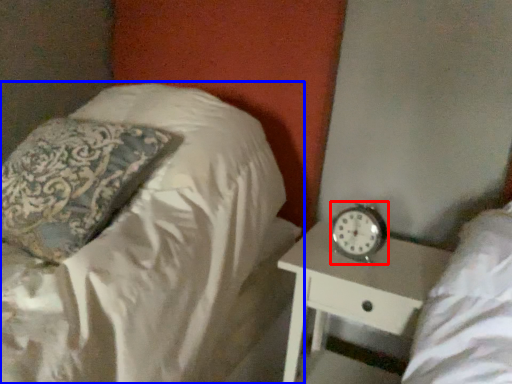
Question: Which object is further to the camera taking this photo, clock (highlighted by a red box) or bed (highlighted by a blue box)?

Choices:
 (A) clock
 (B) bed

Answer: (A)